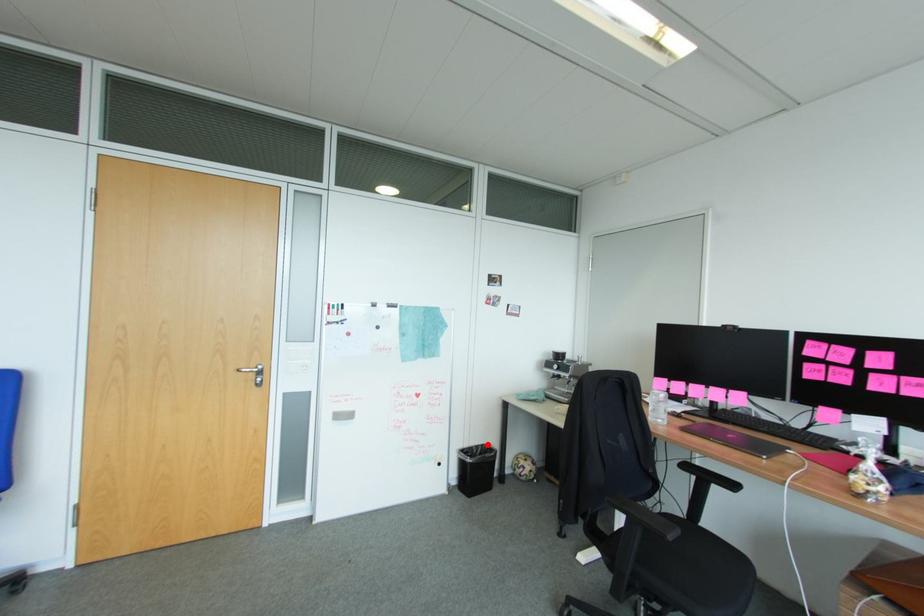
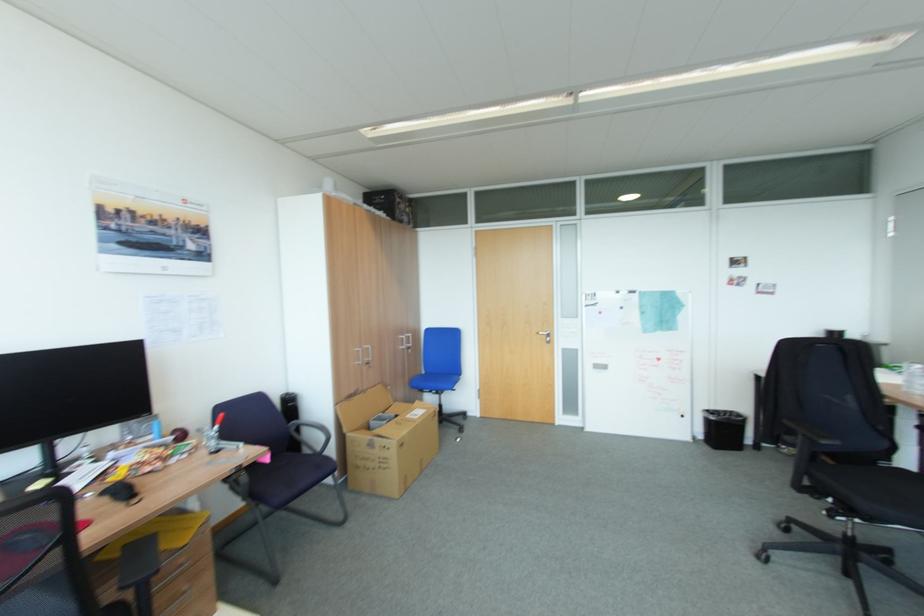
Locate, in the second image, the point that corresponds to the highlighted location in the first image.

(736, 411)